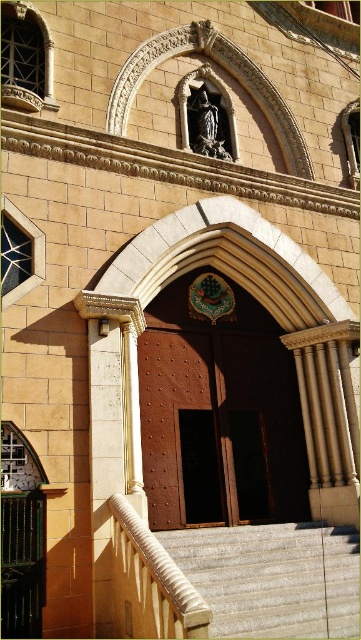
You are standing in front of the Gothic Revival building and want to enter through the entrance. Where exactly is the brown polished wood door at center located in relation to the other architectural elements?

The brown polished wood door at center is located at point (219, 416), which places it centrally within the arched doorway, flanked by two lighter columns and beneath the decorative emblem with a cross and greenery.